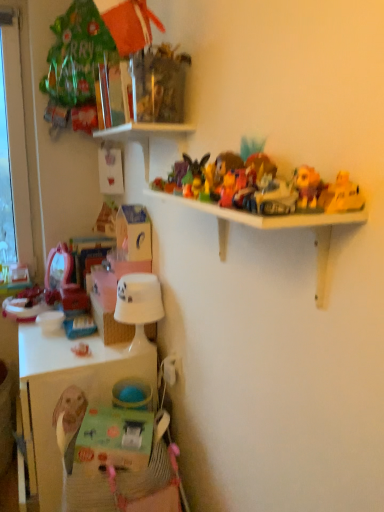
You are a GUI agent. You are given a task and a screenshot of the screen. Output one action in this format:
    pyautogui.click(x=<x>, y=<y>)
    Task: Click on the free area in between white glossy lampshade at lower center and matte pink toy at lower left, which is counted as the first toy, starting from the left
    The width and height of the screenshot is (384, 512).
    Given the screenshot: What is the action you would take?
    pyautogui.click(x=98, y=358)